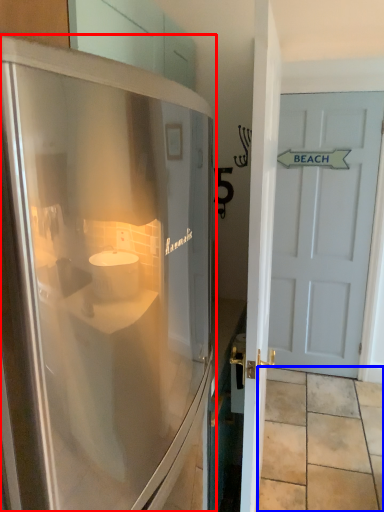
Question: Which object is further to the camera taking this photo, refrigerator (highlighted by a red box) or tile (highlighted by a blue box)?

Choices:
 (A) refrigerator
 (B) tile

Answer: (B)